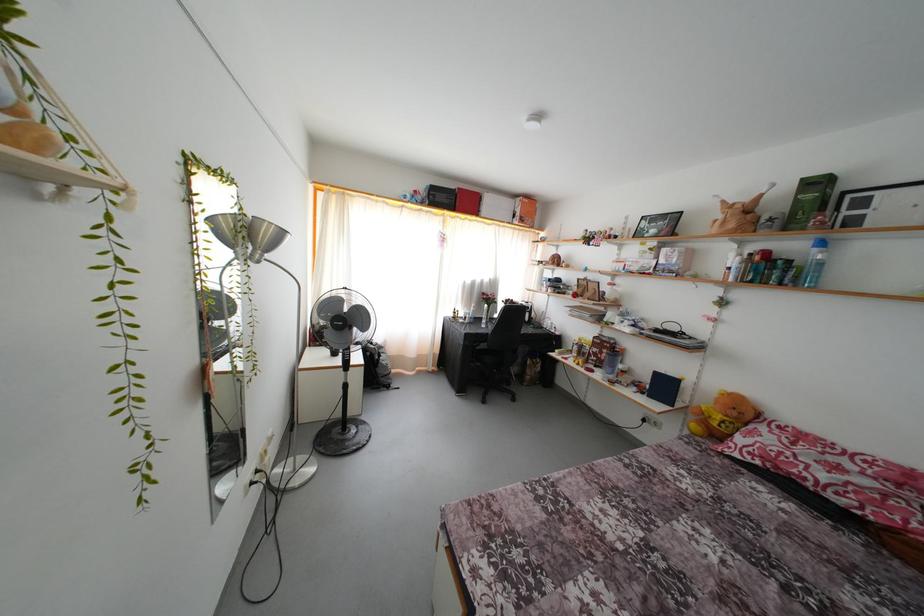
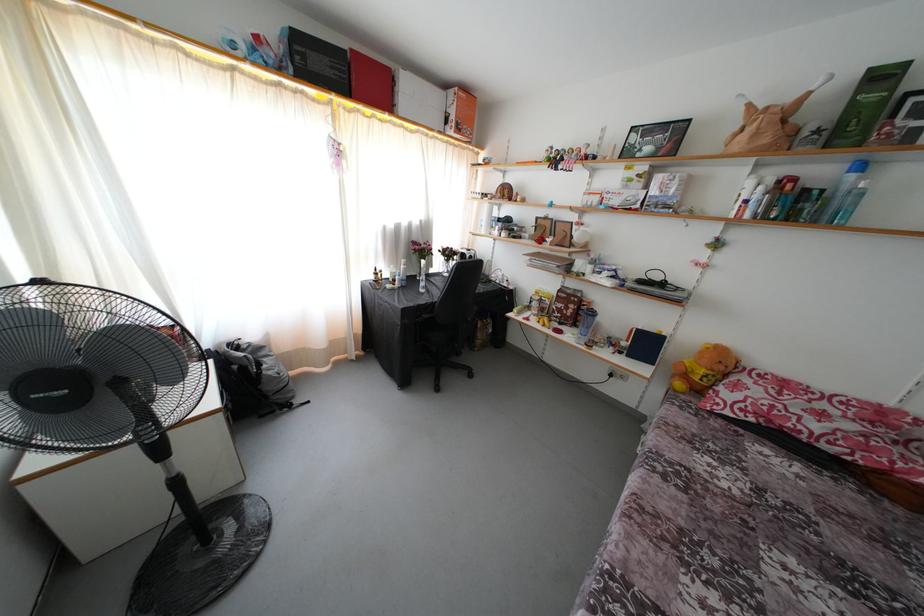
Where in the second image is the point corresponding to pixel 738 419 from the first image?

(726, 373)